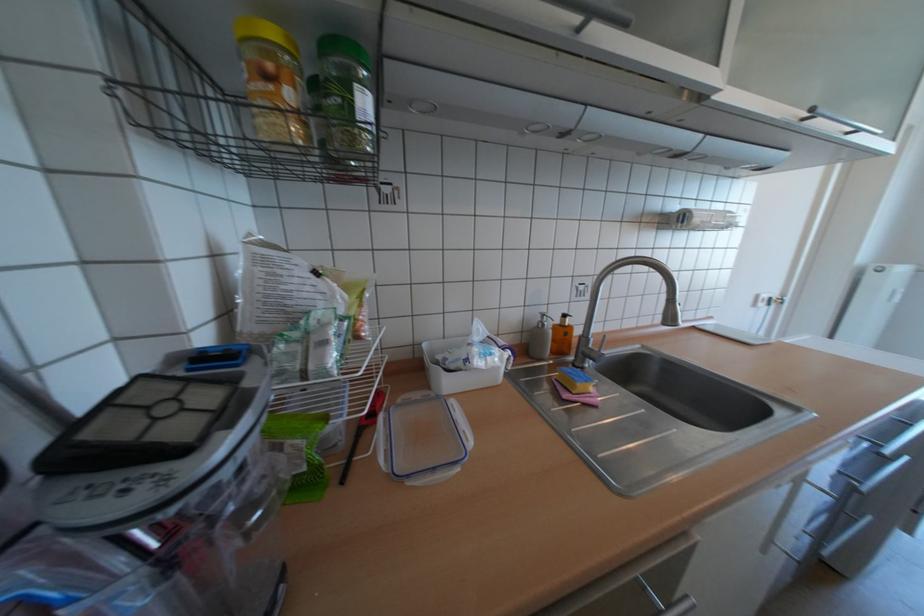
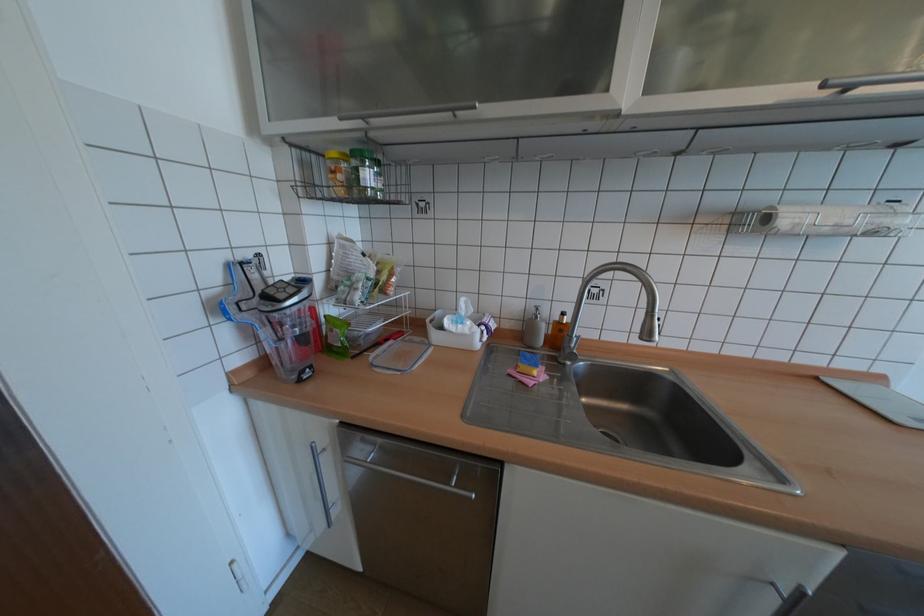
Find the pixel in the second image that matches (x=565, y=321) in the first image.

(565, 317)